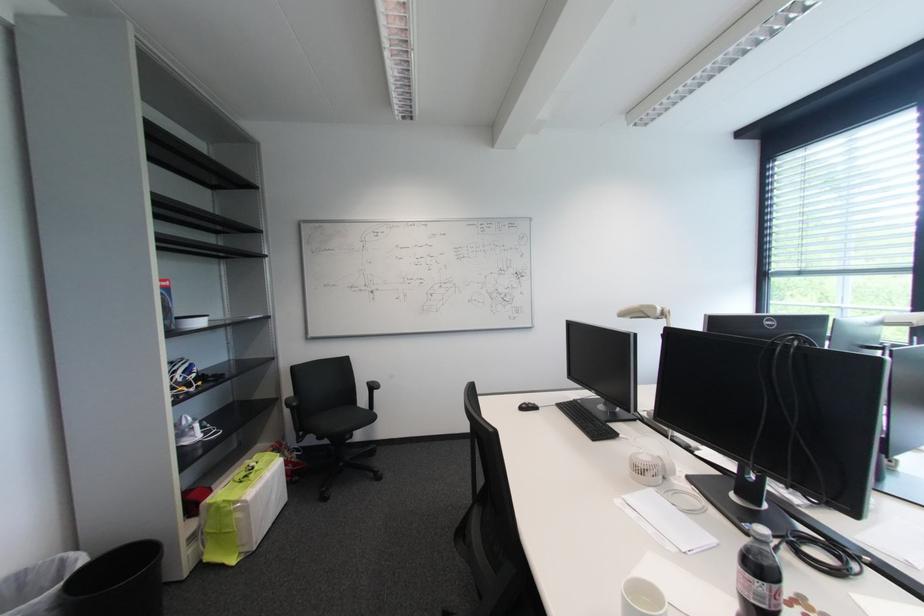
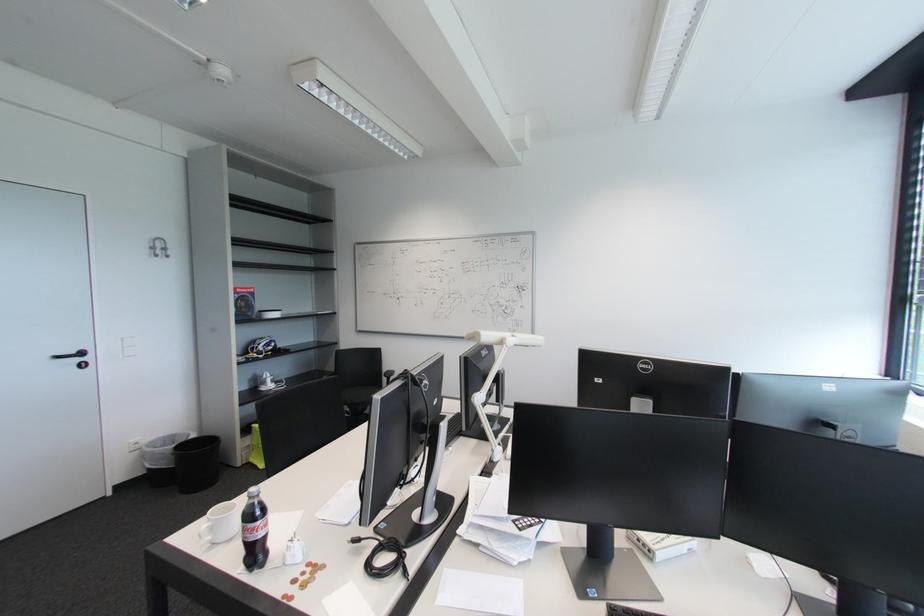
The point at (181,373) is marked in the first image. Where is the corresponding point in the second image?

(265, 346)